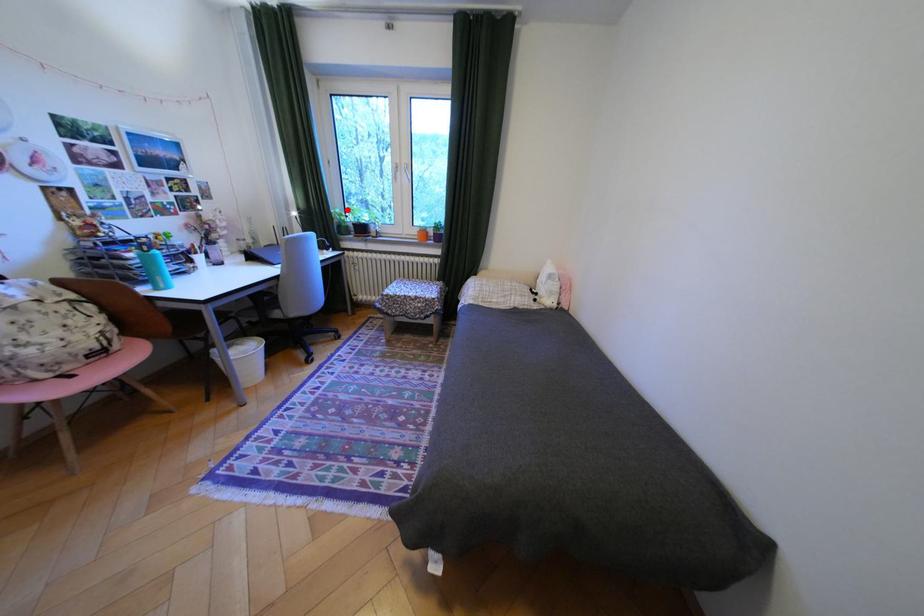
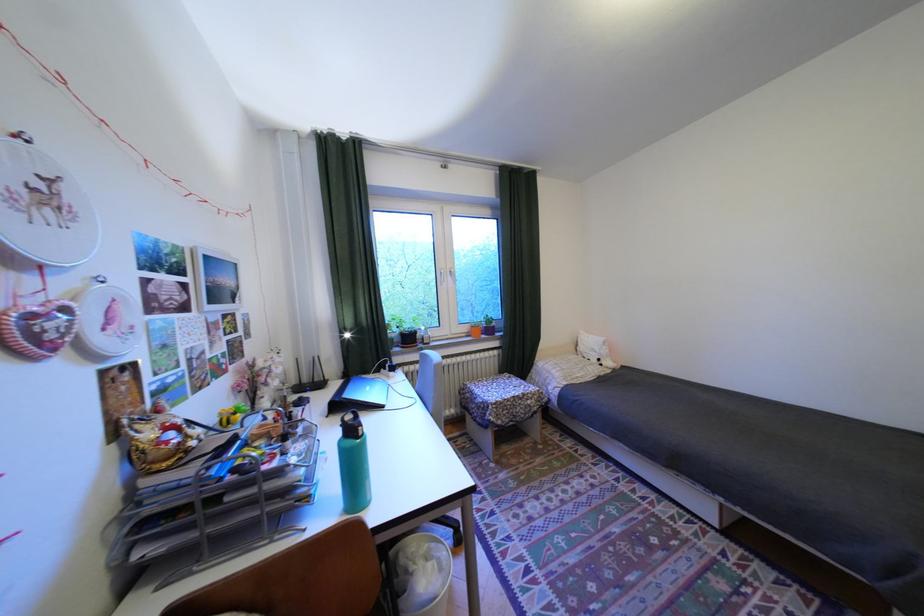
In the second image, find the point that corresponds to the highlighted location in the first image.

(397, 322)